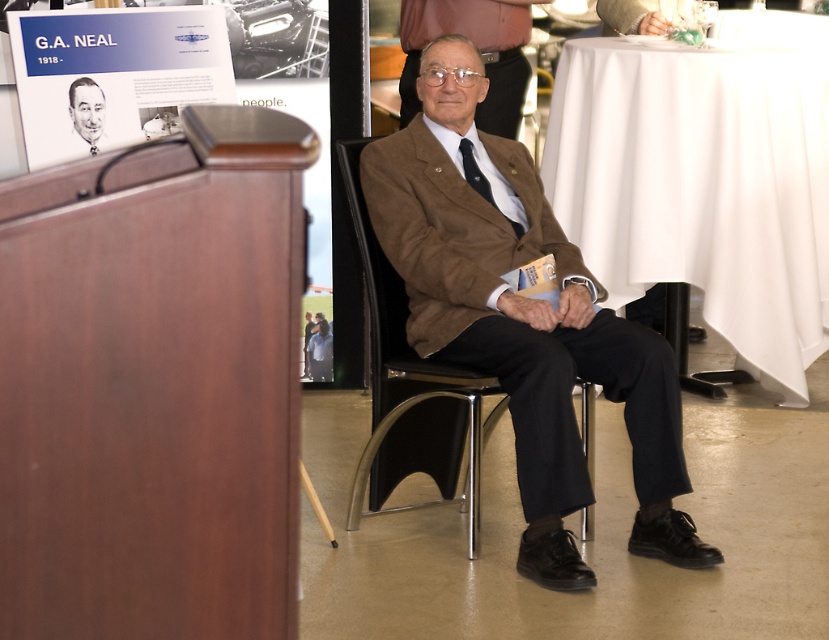
In the scene shown: You are organizing a small event and need to place a 1.2 meter wide banner on one of the available surfaces. The banner must be placed on either the white cloth at right or the matte black portrait at upper left. Based on their sizes, which surface can accommodate the banner?

The white cloth at right has a larger size compared to the matte black portrait at upper left, so the banner can be placed on the white cloth at right.

You are organizing a small event and need to decide which item to use for a decoration. The white cloth at right and the matte paper poster at upper left are available. Which one has a larger size?

The white cloth at right is bigger than the matte paper poster at upper left, so it is the larger option for decoration.

You are an event organizer setting up the stage for a presentation. You notice the white cloth at right and the matte black portrait at upper left. Which object is taller?

The white cloth at right is taller than the matte black portrait at upper left according to the description.